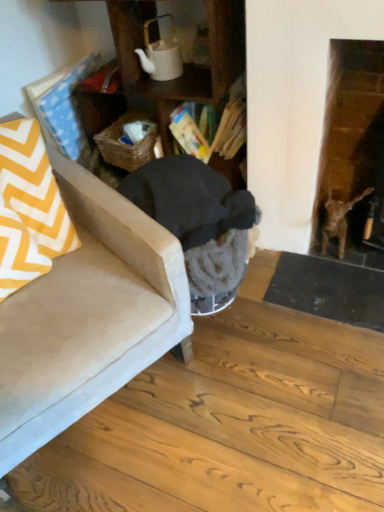
Question: Should I look upward or downward to see wooden cabinet at center?

Choices:
 (A) down
 (B) up

Answer: (B)

Question: Are wooden cabinet at center and white matte teapot at upper center beside each other?

Choices:
 (A) yes
 (B) no

Answer: (B)

Question: Considering the relative sizes of wooden cabinet at center and white matte teapot at upper center in the image provided, is wooden cabinet at center smaller than white matte teapot at upper center?

Choices:
 (A) no
 (B) yes

Answer: (A)

Question: Is wooden cabinet at center taller than white matte teapot at upper center?

Choices:
 (A) yes
 (B) no

Answer: (A)

Question: Is wooden cabinet at center thinner than white matte teapot at upper center?

Choices:
 (A) yes
 (B) no

Answer: (B)

Question: Is wooden cabinet at center not near white matte teapot at upper center?

Choices:
 (A) yes
 (B) no

Answer: (B)

Question: From a real-world perspective, is wooden cabinet at center on top of white matte teapot at upper center?

Choices:
 (A) yes
 (B) no

Answer: (B)

Question: From the image's perspective, does suede beige chair at lower left appear higher than white matte teapot at upper center?

Choices:
 (A) yes
 (B) no

Answer: (B)

Question: Is suede beige chair at lower left next to white matte teapot at upper center and touching it?

Choices:
 (A) no
 (B) yes

Answer: (A)

Question: Can you confirm if suede beige chair at lower left is shorter than white matte teapot at upper center?

Choices:
 (A) no
 (B) yes

Answer: (A)

Question: Considering the relative sizes of suede beige chair at lower left and white matte teapot at upper center in the image provided, is suede beige chair at lower left wider than white matte teapot at upper center?

Choices:
 (A) yes
 (B) no

Answer: (A)

Question: From a real-world perspective, is suede beige chair at lower left over white matte teapot at upper center?

Choices:
 (A) yes
 (B) no

Answer: (B)

Question: Considering the relative positions of suede beige chair at lower left and white matte teapot at upper center in the image provided, is suede beige chair at lower left to the left of white matte teapot at upper center from the viewer's perspective?

Choices:
 (A) yes
 (B) no

Answer: (A)

Question: Is woven brown basket at center facing towards suede beige chair at lower left?

Choices:
 (A) yes
 (B) no

Answer: (A)